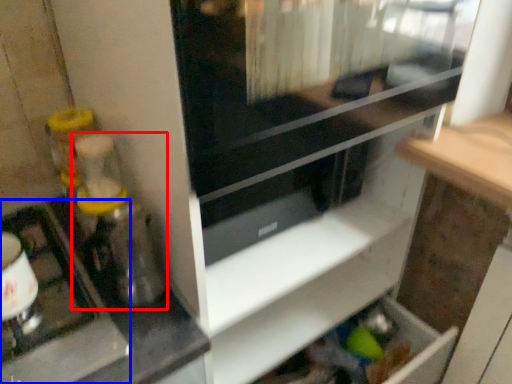
Question: Which object is further to the camera taking this photo, blender (highlighted by a red box) or appliance (highlighted by a blue box)?

Choices:
 (A) blender
 (B) appliance

Answer: (A)